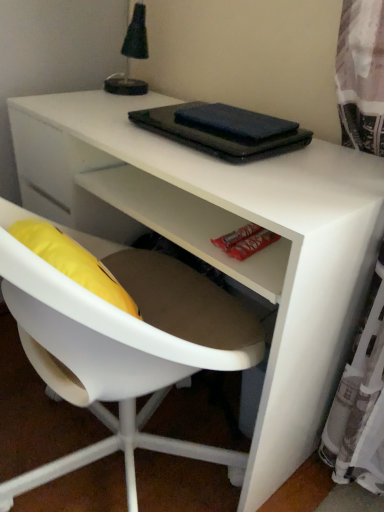
Question: Looking at their shapes, would you say dark blue matte notebook at upper center, the second notebook positioned from the bottom, is wider or thinner than black fabric lampshade at upper left?

Choices:
 (A) wide
 (B) thin

Answer: (B)

Question: From the image's perspective, is dark blue matte notebook at upper center, the second notebook positioned from the bottom, located above or below black fabric lampshade at upper left?

Choices:
 (A) below
 (B) above

Answer: (A)

Question: Estimate the real-world distances between objects in this image. Which object is farther from the white plastic chair at center?

Choices:
 (A) black matte notebook at center, the 2th notebook positioned from the top
 (B) dark blue matte notebook at upper center, the second notebook positioned from the bottom
 (C) black fabric lampshade at upper left

Answer: (C)

Question: Considering the real-world distances, which object is farthest from the black fabric lampshade at upper left?

Choices:
 (A) dark blue matte notebook at upper center, which appears as the first notebook when viewed from the top
 (B) white plastic chair at center
 (C) black matte notebook at center, which is the first notebook from bottom to top

Answer: (B)